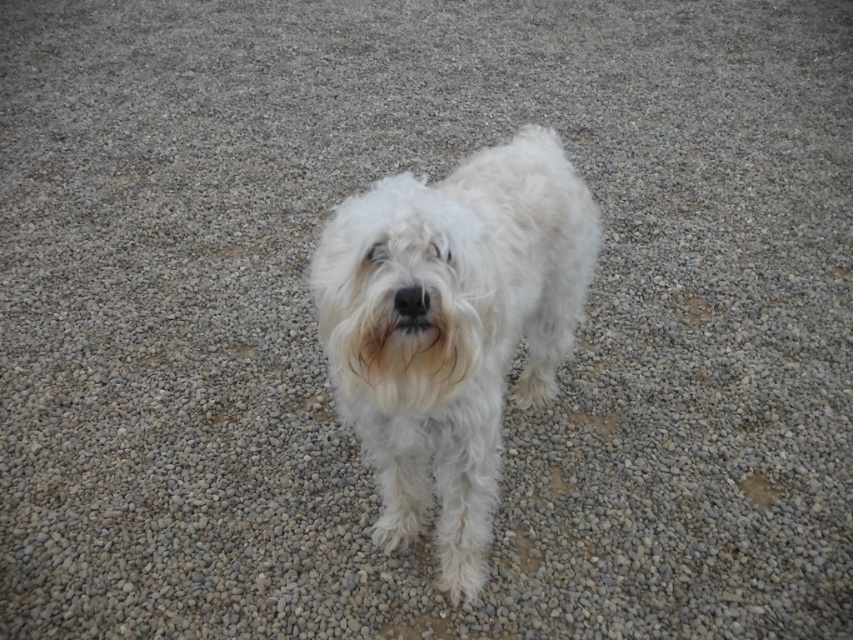
Question: Can you confirm if white fluffy dog at center is bigger than black fur at center?

Choices:
 (A) no
 (B) yes

Answer: (B)

Question: Which point appears farthest from the camera in this image?

Choices:
 (A) (383, 416)
 (B) (403, 300)

Answer: (A)

Question: Does white fluffy dog at center appear on the right side of black fur at center?

Choices:
 (A) yes
 (B) no

Answer: (A)

Question: Does white fluffy dog at center appear over black fur at center?

Choices:
 (A) yes
 (B) no

Answer: (B)